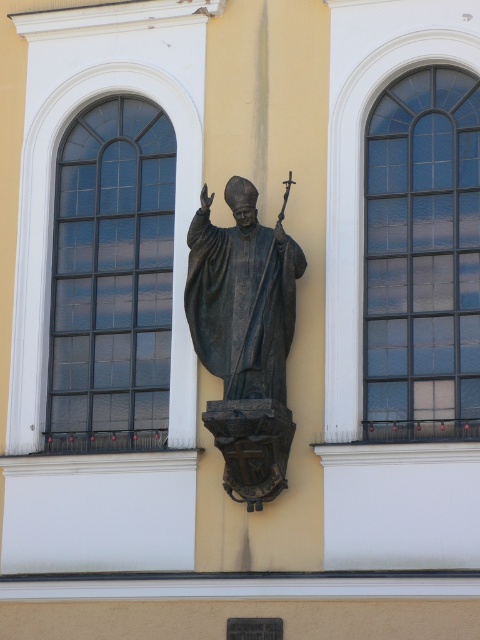
Question: Does clear glass window at right appear on the left side of bronze statue at center?

Choices:
 (A) yes
 (B) no

Answer: (B)

Question: Estimate the real-world distances between objects in this image. Which object is closer to the bronze statue at center?

Choices:
 (A) black glass window at left
 (B) clear glass window at right

Answer: (B)

Question: Can you confirm if clear glass window at right is bigger than bronze statue at center?

Choices:
 (A) yes
 (B) no

Answer: (A)

Question: Which object is positioned closest to the black glass window at left?

Choices:
 (A) bronze statue at center
 (B) clear glass window at right

Answer: (A)

Question: Can you confirm if clear glass window at right is wider than black glass window at left?

Choices:
 (A) yes
 (B) no

Answer: (A)

Question: Among these points, which one is nearest to the camera?

Choices:
 (A) (411, 360)
 (B) (157, 180)
 (C) (262, 296)

Answer: (C)